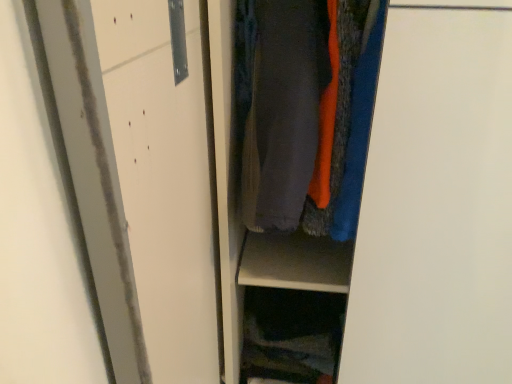
Question: Can you confirm if dark fabric at lower center is taller than dark gray fabric at center?

Choices:
 (A) yes
 (B) no

Answer: (B)

Question: Is dark fabric at lower center facing towards dark gray fabric at center?

Choices:
 (A) yes
 (B) no

Answer: (B)

Question: Is there a large distance between dark fabric at lower center and dark gray fabric at center?

Choices:
 (A) no
 (B) yes

Answer: (A)

Question: Considering the relative sizes of dark fabric at lower center and dark gray fabric at center in the image provided, is dark fabric at lower center shorter than dark gray fabric at center?

Choices:
 (A) yes
 (B) no

Answer: (A)

Question: From the image's perspective, is dark fabric at lower center located beneath dark gray fabric at center?

Choices:
 (A) no
 (B) yes

Answer: (B)

Question: Is dark fabric at lower center bigger than dark gray fabric at center?

Choices:
 (A) yes
 (B) no

Answer: (B)

Question: Does dark gray fabric at center touch dark fabric at lower center?

Choices:
 (A) no
 (B) yes

Answer: (A)

Question: From the image's perspective, is dark gray fabric at center located beneath dark fabric at lower center?

Choices:
 (A) no
 (B) yes

Answer: (A)

Question: Does dark gray fabric at center turn towards dark fabric at lower center?

Choices:
 (A) yes
 (B) no

Answer: (B)

Question: Is dark fabric at lower center surrounded by dark gray fabric at center?

Choices:
 (A) no
 (B) yes

Answer: (A)

Question: Is dark gray fabric at center bigger than dark fabric at lower center?

Choices:
 (A) yes
 (B) no

Answer: (A)

Question: Can you confirm if dark gray fabric at center is wider than dark fabric at lower center?

Choices:
 (A) no
 (B) yes

Answer: (B)

Question: Would you say dark gray fabric at center is to the left or to the right of dark fabric at lower center in the picture?

Choices:
 (A) left
 (B) right

Answer: (B)